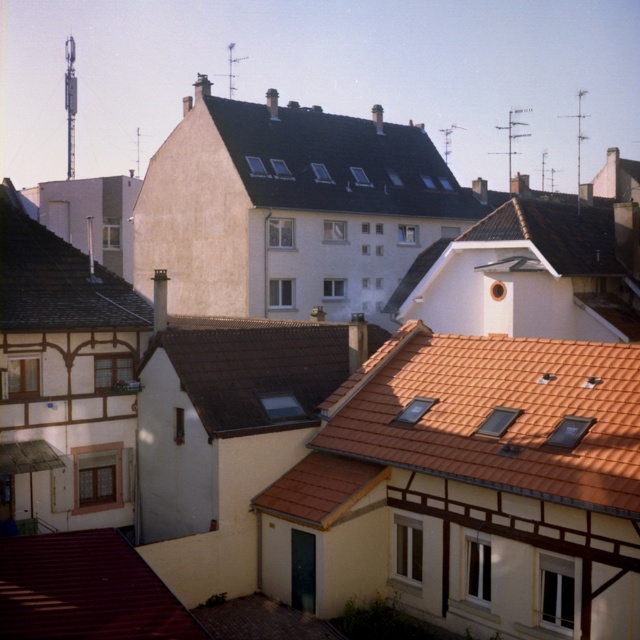
What do you see at coordinates (252, 371) in the screenshot?
I see `brown tile roof at center` at bounding box center [252, 371].

Is point (221, 333) positioned before point (52, 577)?

No, (221, 333) is further to viewer.

Is point (244, 321) in front of point (140, 564)?

No, (244, 321) is behind (140, 564).

Find the location of a particular element. The width and height of the screenshot is (640, 640). brown tile roof at center is located at coordinates (252, 371).

Image resolution: width=640 pixels, height=640 pixels. I want to click on brown tile roof at center, so click(x=252, y=371).

The height and width of the screenshot is (640, 640). What do you see at coordinates (252, 371) in the screenshot?
I see `brown tile roof at center` at bounding box center [252, 371].

Locate an element on the screen. brown tile roof at center is located at coordinates (252, 371).

Between orange tile roof at center and brown tile roof at center, which one has less height?

Standing shorter between the two is brown tile roof at center.

Can you confirm if orange tile roof at center is taller than brown tile roof at center?

Yes, orange tile roof at center is taller than brown tile roof at center.

Who is more distant from viewer, (x=492, y=422) or (x=205, y=365)?

Point (x=205, y=365)

At what (x,y) coordinates should I click in order to perform the action: click on orange tile roof at center. Please return your answer as a coordinate pair (x, y). This screenshot has width=640, height=640. Looking at the image, I should click on (499, 413).